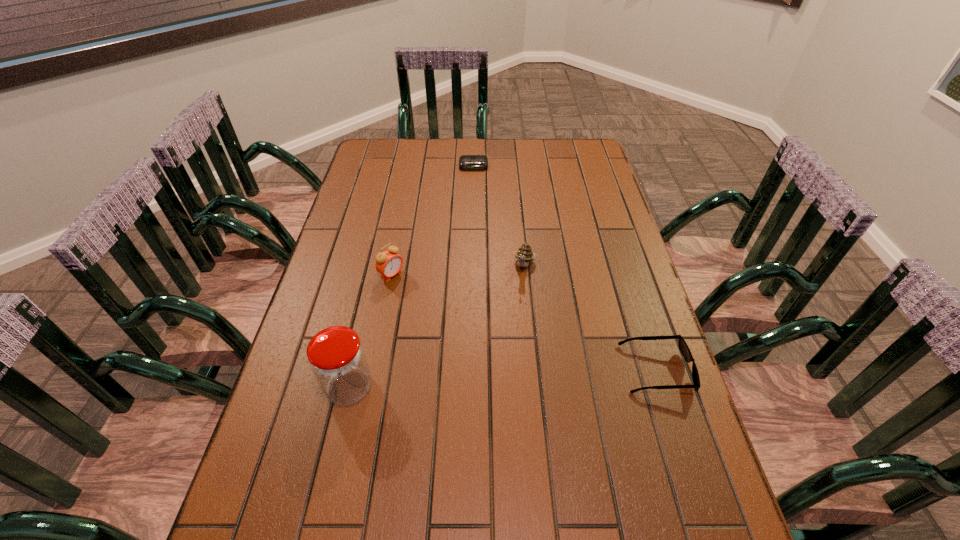
Image resolution: width=960 pixels, height=540 pixels. What are the coordinates of `free location located on the face of the snail` in the screenshot? It's located at [x=500, y=357].

The image size is (960, 540). Find the location of `vacant region located on the face of the snail`. vacant region located on the face of the snail is located at coordinates pyautogui.click(x=520, y=291).

This screenshot has width=960, height=540. In order to click on free point located 0.290m on the display of the farthest object in this screenshot , I will do `click(473, 219)`.

Identify the location of vacant area located 0.170m on the display of the farthest object. (473, 198).

This screenshot has height=540, width=960. What are the coordinates of `vacant region located on the display of the farthest object` in the screenshot? It's located at (473, 202).

Where is `free location located on the face of the left alarm clock`? free location located on the face of the left alarm clock is located at coordinates (505, 357).

Where is `vacant region located 0.250m on the face of the left alarm clock`? The image size is (960, 540). vacant region located 0.250m on the face of the left alarm clock is located at coordinates (464, 327).

Locate an element on the screen. This screenshot has width=960, height=540. vacant space located on the face of the left alarm clock is located at coordinates pyautogui.click(x=508, y=360).

Image resolution: width=960 pixels, height=540 pixels. What are the coordinates of `object that is positioned at the far edge` in the screenshot? It's located at (466, 162).

I want to click on object present at the left edge, so click(x=337, y=358).